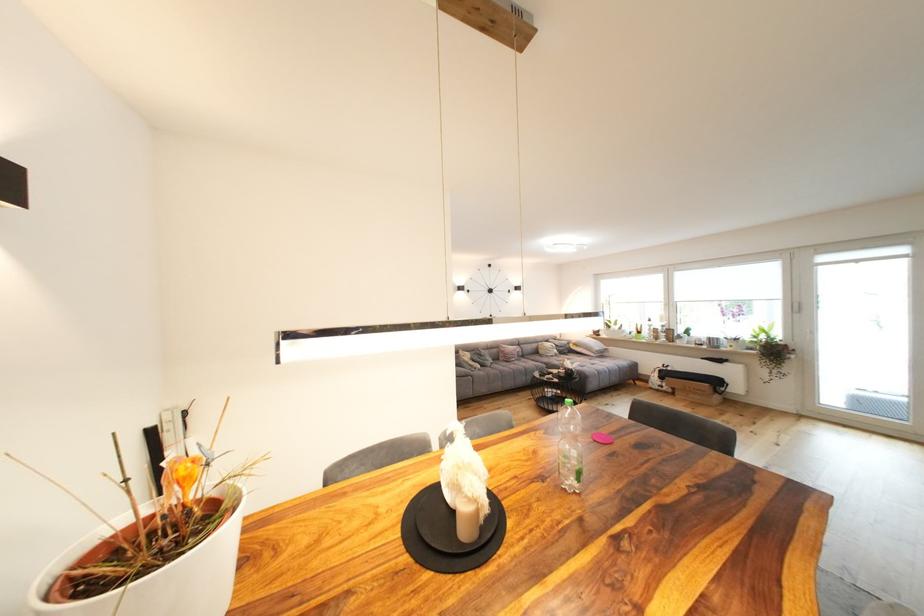
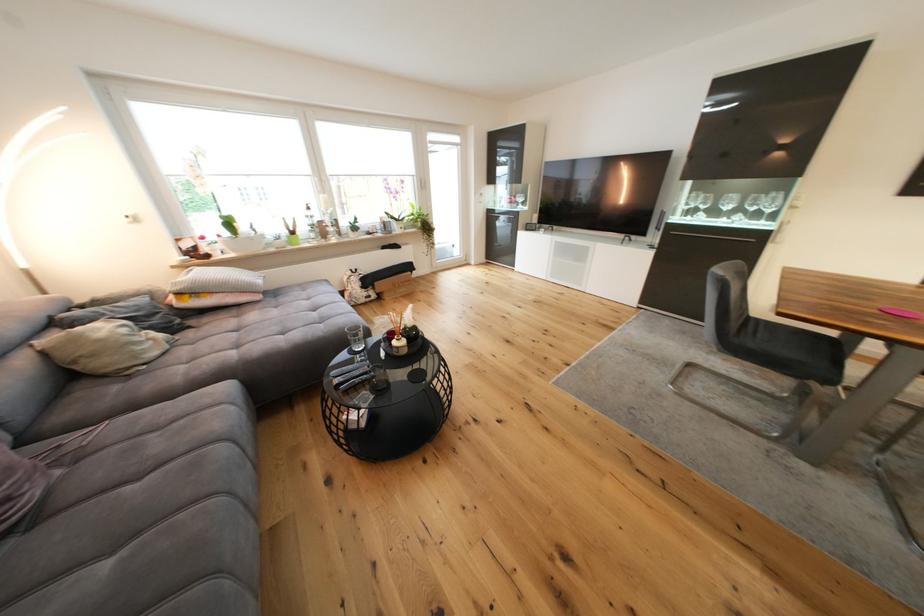
Find the pixel in the second image that matches (563,353) in the first image.

(161, 336)